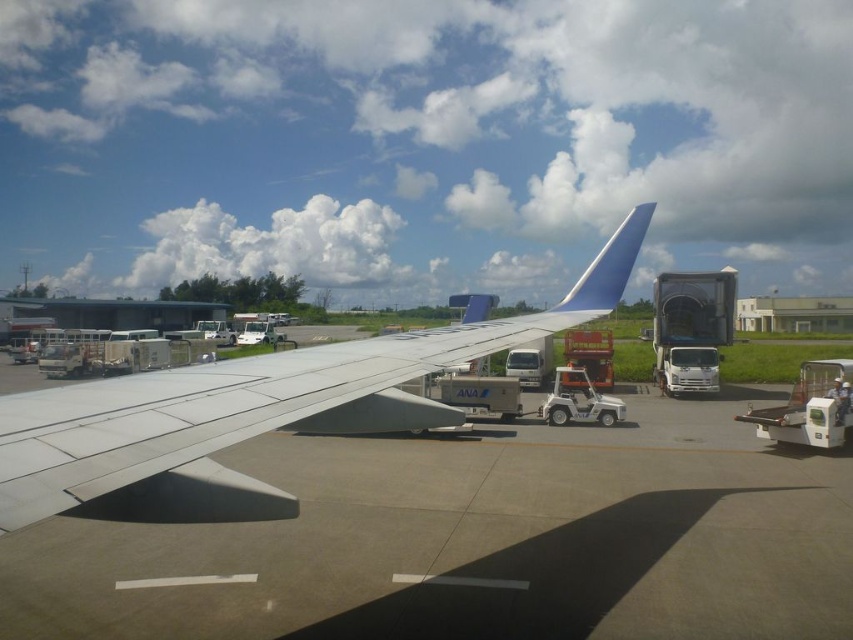
Question: From the image, what is the correct spatial relationship of white matte airplane wing at center in relation to blue matte wingtip at upper right?

Choices:
 (A) left
 (B) right

Answer: (A)

Question: Can you confirm if white matte airplane wing at center is positioned below blue matte wingtip at upper right?

Choices:
 (A) no
 (B) yes

Answer: (B)

Question: Which point is closer to the camera taking this photo?

Choices:
 (A) (x=82, y=426)
 (B) (x=607, y=292)

Answer: (A)

Question: Is white matte airplane wing at center further to the viewer compared to blue matte wingtip at upper right?

Choices:
 (A) no
 (B) yes

Answer: (A)